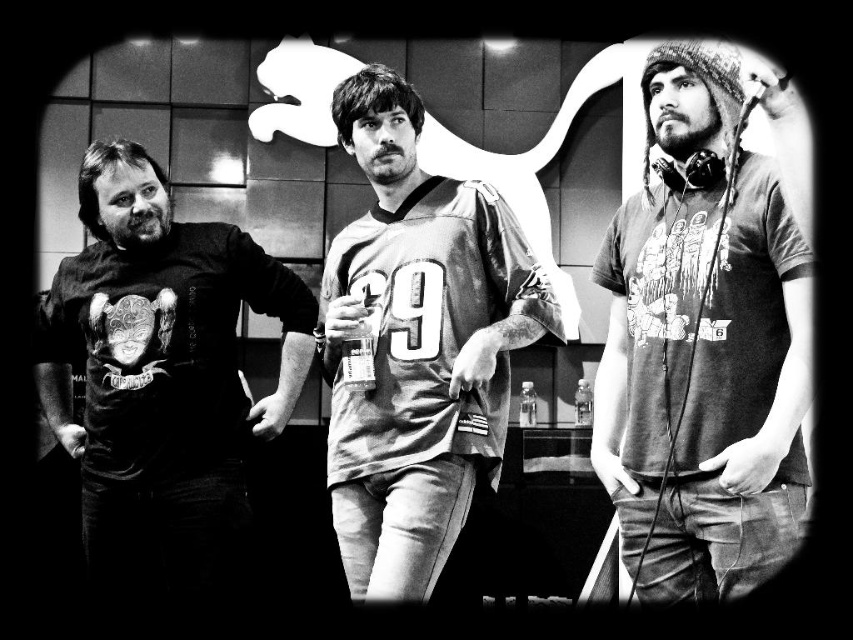
Between matte black t-shirt at left and metallic jersey at center, which one has more height?

With more height is matte black t-shirt at left.

Which is more to the right, matte black t-shirt at left or metallic jersey at center?

From the viewer's perspective, metallic jersey at center appears more on the right side.

Image resolution: width=853 pixels, height=640 pixels. What do you see at coordinates (161, 392) in the screenshot?
I see `matte black t-shirt at left` at bounding box center [161, 392].

In order to click on matte black t-shirt at left in this screenshot , I will do `click(161, 392)`.

Does matte gray t-shirt at right have a greater height compared to metallic jersey at center?

Incorrect, matte gray t-shirt at right's height is not larger of metallic jersey at center's.

Is point (614, 401) farther from camera compared to point (363, 524)?

No, (614, 401) is in front of (363, 524).

What do you see at coordinates (701, 348) in the screenshot?
I see `matte gray t-shirt at right` at bounding box center [701, 348].

Identify the location of matte gray t-shirt at right. The image size is (853, 640). (701, 348).

Does matte gray t-shirt at right appear under matte black t-shirt at left?

No.

Which is below, matte gray t-shirt at right or matte black t-shirt at left?

Positioned lower is matte black t-shirt at left.

This screenshot has width=853, height=640. I want to click on matte gray t-shirt at right, so click(701, 348).